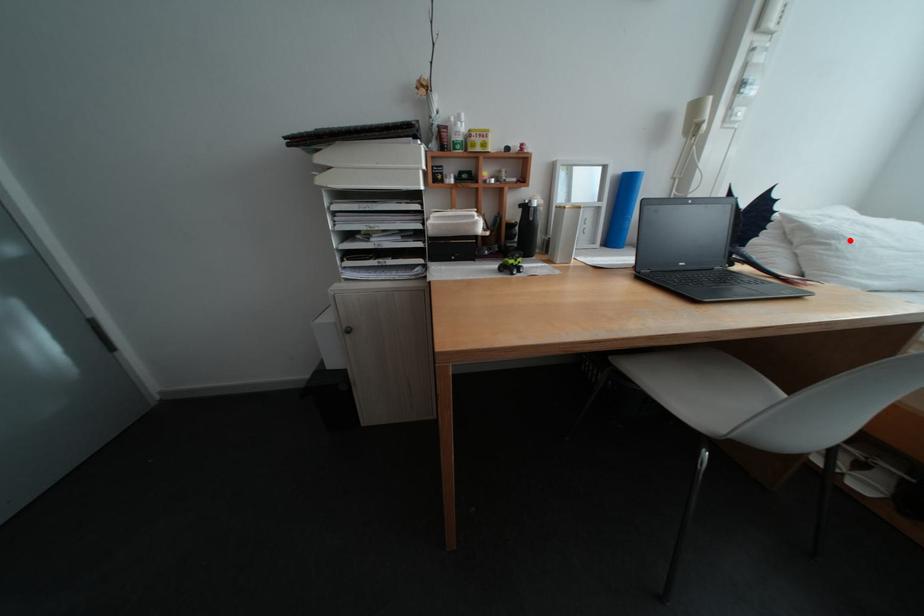
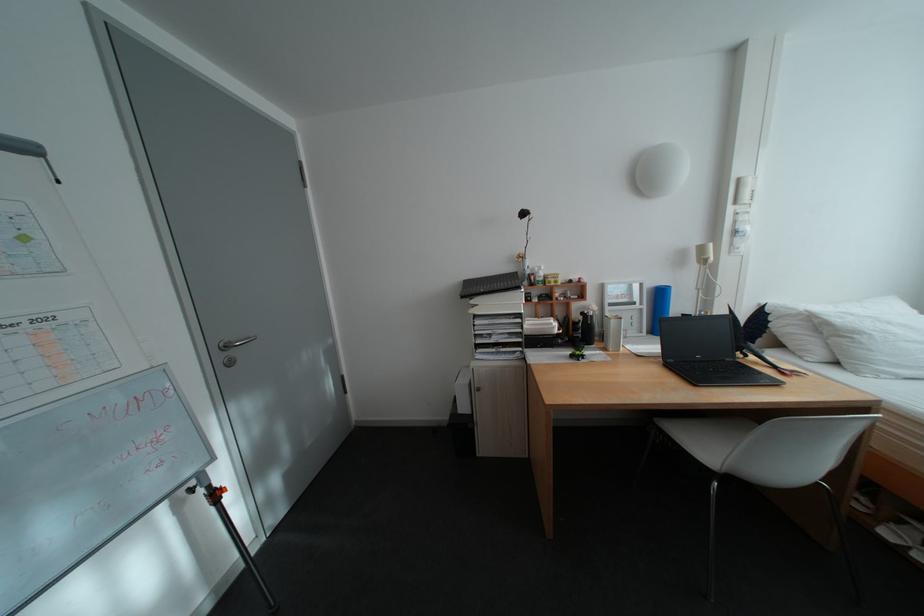
Question: I am providing you with two images of the same scene from different viewpoints. In image1, a red point is highlighted. Considering the same 3D point in image2, which of the following is correct?

Choices:
 (A) It is closer
 (B) It is farther

Answer: (A)